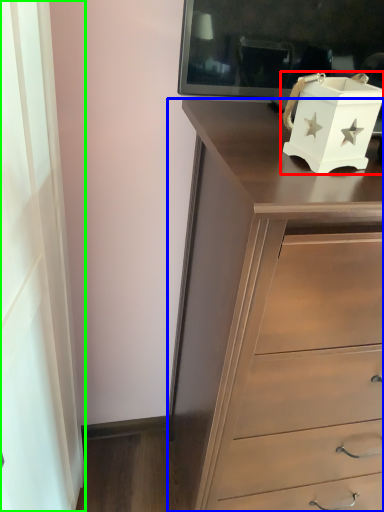
Question: Considering the real-world distances, which object is farthest from box (highlighted by a red box)? chest of drawers (highlighted by a blue box) or curtain (highlighted by a green box)?

Choices:
 (A) chest of drawers
 (B) curtain

Answer: (B)